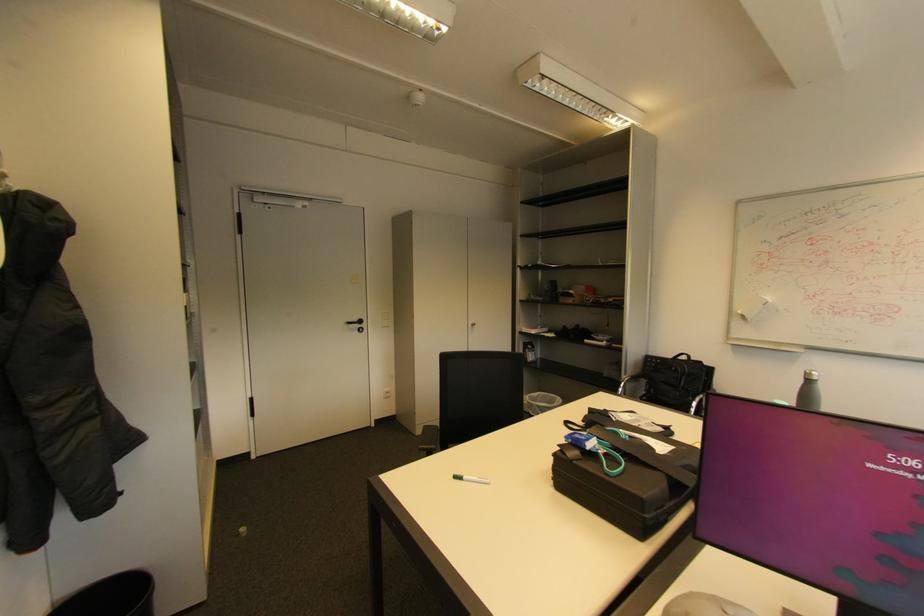
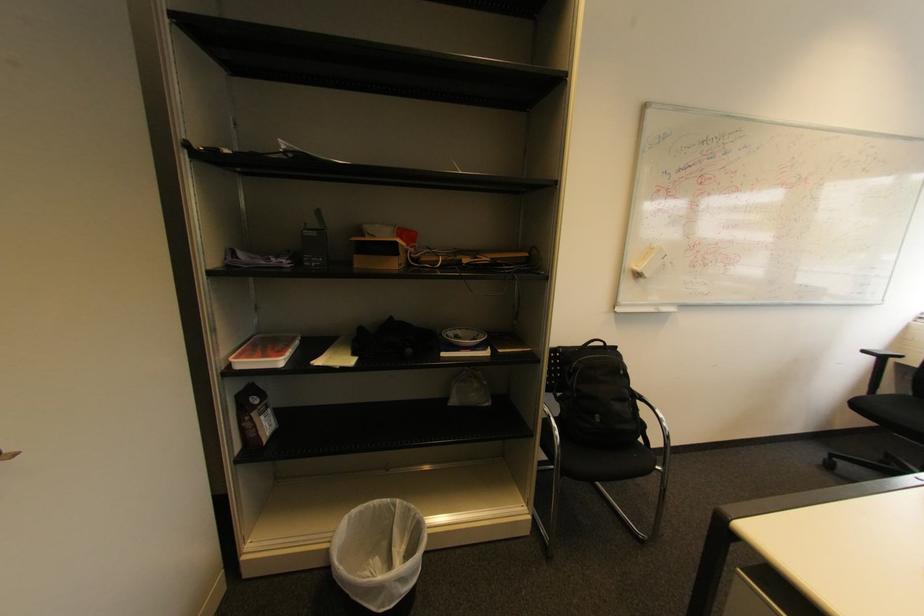
Locate, in the second image, the point that corresponds to the point at 576,296 in the first image.

(395, 251)